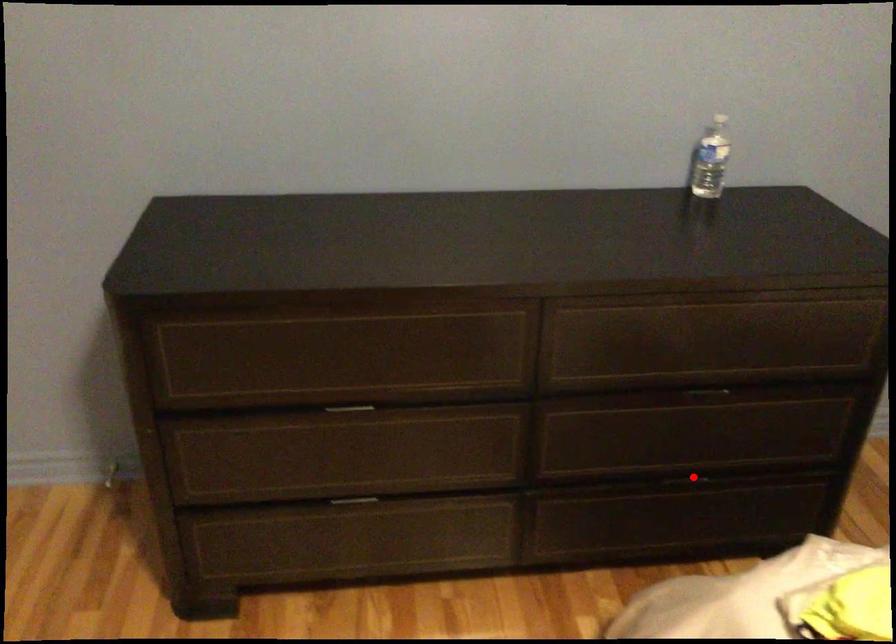
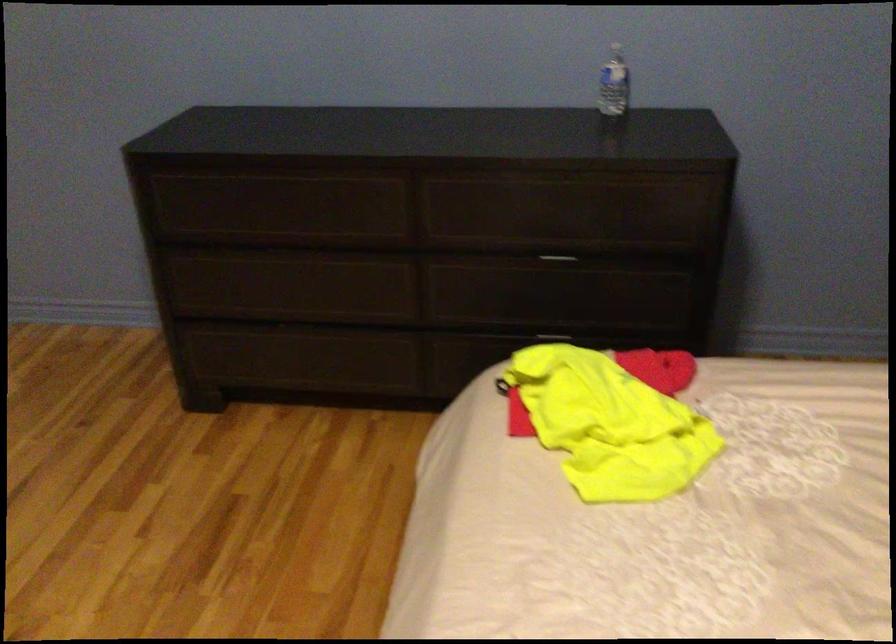
Question: I am providing you with two images of the same scene from different viewpoints. Image1 has a red point marked. In image2, the corresponding 3D location appears at what relative position? Reply with the corresponding letter.

Choices:
 (A) Closer
 (B) Farther

Answer: (B)